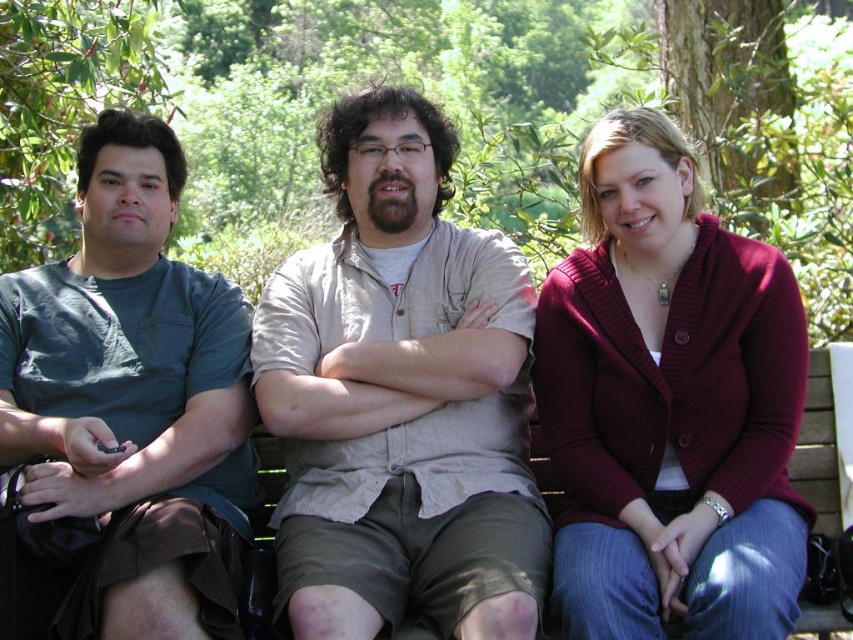
You are standing in front of the three people on the bench. There are two points marked in the image. Which point is closer to you, point at (706, 524) or point at (22, 428)?

Point at (706, 524) is closer to you than point at (22, 428).